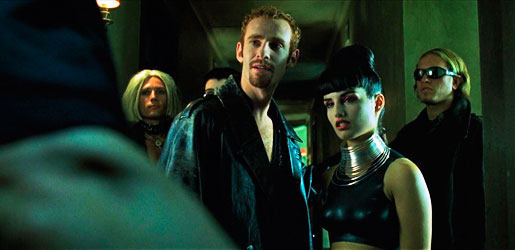
I want to click on ceiling, so click(324, 9), click(322, 77), click(219, 38).